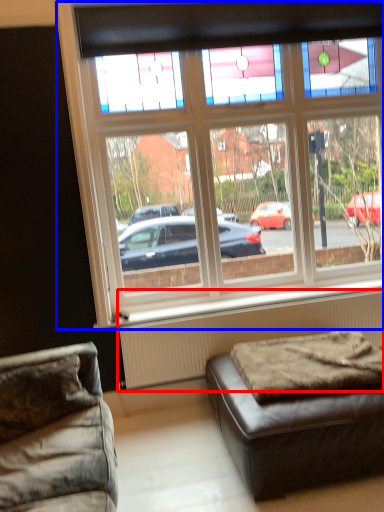
Question: Among these objects, which one is farthest to the camera, radiator (highlighted by a red box) or window (highlighted by a blue box)?

Choices:
 (A) radiator
 (B) window

Answer: (A)